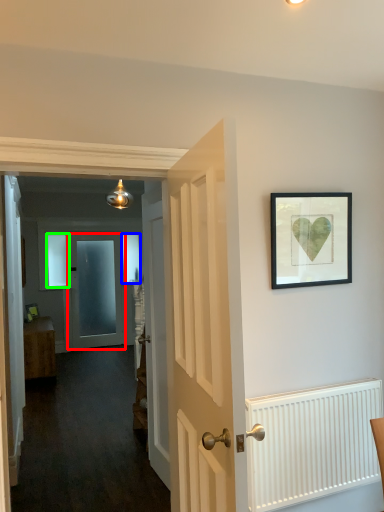
Question: Based on their relative distances, which object is farther from door (highlighted by a red box)? Choose from window (highlighted by a blue box) and window (highlighted by a green box).

Choices:
 (A) window
 (B) window

Answer: (B)